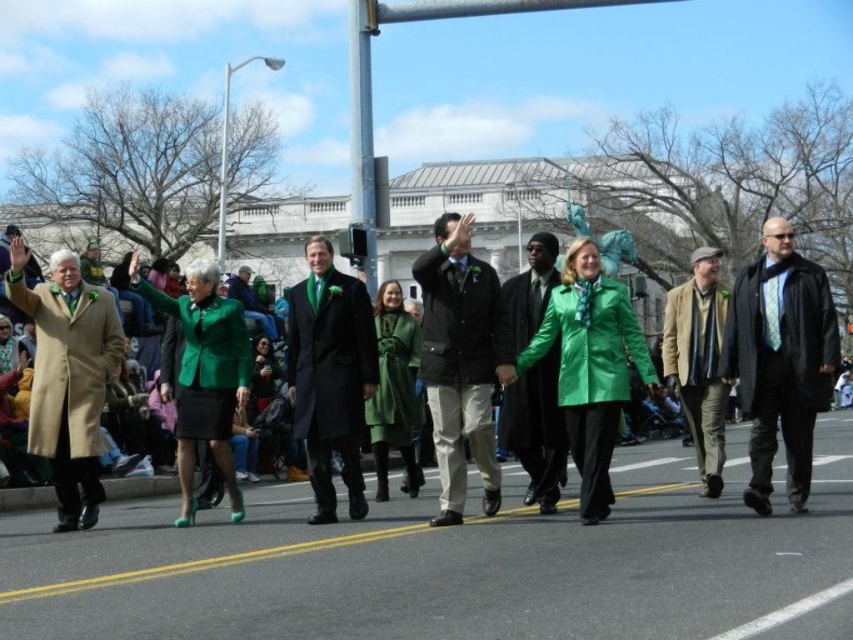
Question: Does black matte coat at right come in front of khaki cotton pants at center?

Choices:
 (A) no
 (B) yes

Answer: (B)

Question: Which point is farther to the camera?

Choices:
 (A) (759, 433)
 (B) (473, 394)
 (C) (140, 480)
 (D) (80, 390)

Answer: (C)

Question: Among these objects, which one is farthest from the camera?

Choices:
 (A) green matte coat at center
 (B) black matte coat at right

Answer: (A)

Question: Which is nearer to the shiny black coat at center?

Choices:
 (A) black matte coat at right
 (B) green matte coat at center

Answer: (A)

Question: Is matte black coat at center below shiny black coat at center?

Choices:
 (A) yes
 (B) no

Answer: (A)

Question: Can you confirm if shiny black coat at center is thinner than khaki cotton pants at center?

Choices:
 (A) yes
 (B) no

Answer: (A)